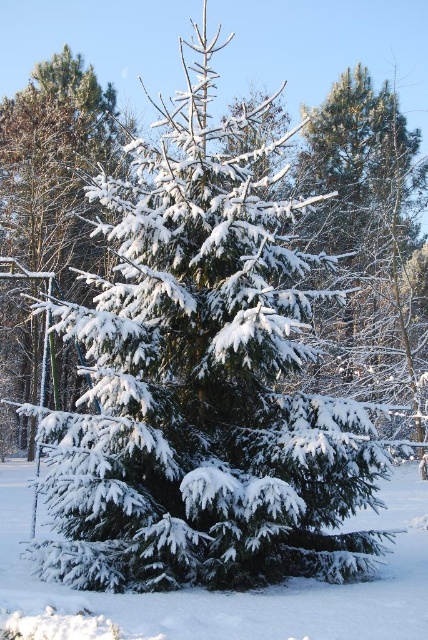
Question: Observing the image, what is the correct spatial positioning of white fluffy snow at center in reference to white frosty pine at left?

Choices:
 (A) right
 (B) left

Answer: (A)

Question: Which point is closer to the camera?

Choices:
 (A) click(x=326, y=112)
 (B) click(x=15, y=112)

Answer: (B)

Question: Which of the following is the farthest from the observer?

Choices:
 (A) (416, 480)
 (B) (297, 180)

Answer: (B)

Question: Does white fluffy snow at center have a smaller size compared to white frosty pine at left?

Choices:
 (A) yes
 (B) no

Answer: (A)

Question: Can you confirm if green matte evergreen tree at upper right is thinner than white fluffy snow at center?

Choices:
 (A) no
 (B) yes

Answer: (B)

Question: Which of the following is the farthest from the observer?

Choices:
 (A) (11, 209)
 (B) (385, 150)
 (C) (416, 632)

Answer: (B)